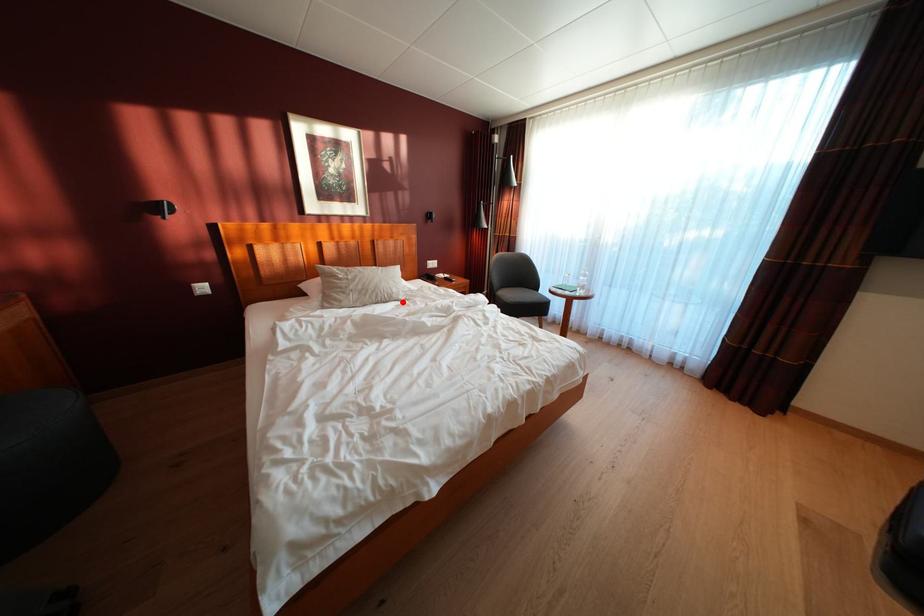
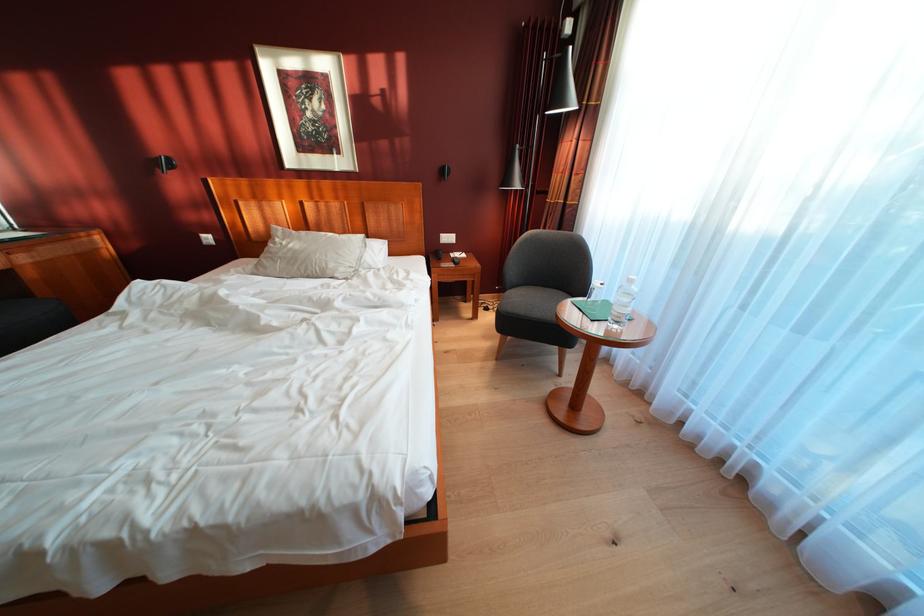
Locate, in the second image, the point that corresponds to the highlighted location in the first image.

(336, 278)